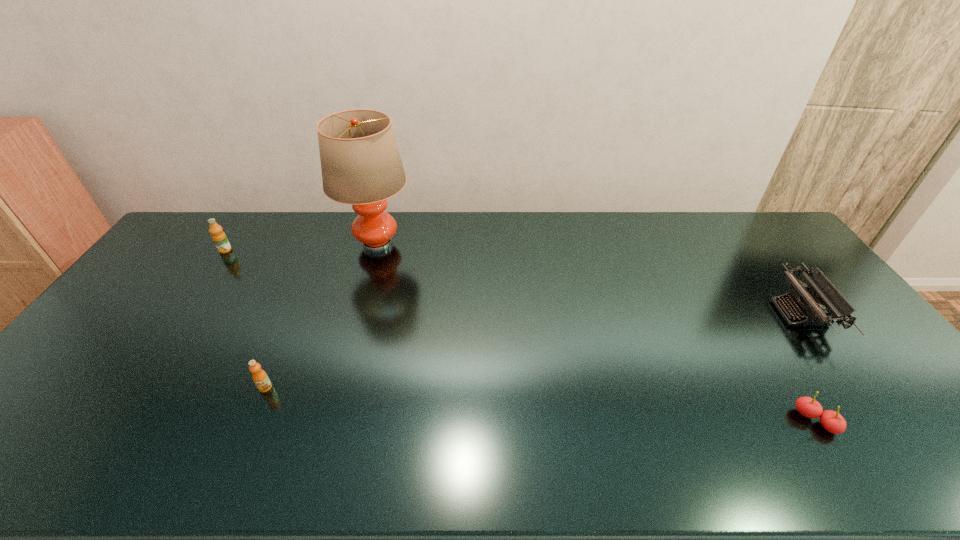
I want to click on free space located 0.390m on the right of the third object from right to left, so click(x=523, y=244).

Locate an element on the screen. This screenshot has width=960, height=540. vacant region located 0.160m on the label of the second tallest object is located at coordinates (202, 286).

At what (x,y) coordinates should I click in order to perform the action: click on vacant space situated on the typing side of the third nearest object. Please return your answer as a coordinate pair (x, y). This screenshot has height=540, width=960. Looking at the image, I should click on (755, 313).

At what (x,y) coordinates should I click in order to perform the action: click on free space located on the typing side of the third nearest object. Please return your answer as a coordinate pair (x, y). The image size is (960, 540). Looking at the image, I should click on 668,313.

Locate an element on the screen. The width and height of the screenshot is (960, 540). vacant space situated on the typing side of the third nearest object is located at coordinates (734, 313).

Locate an element on the screen. vacant space situated on the front label of the second object from left to right is located at coordinates (228, 476).

I want to click on free region located on the left of the nearest object, so click(768, 421).

Where is `lamp that is positioned at the far edge`? The image size is (960, 540). lamp that is positioned at the far edge is located at coordinates (360, 162).

Locate an element on the screen. The height and width of the screenshot is (540, 960). orange juice that is positioned at the far edge is located at coordinates (219, 238).

At what (x,y) coordinates should I click in order to perform the action: click on object located in the right edge section of the desktop. Please return your answer as a coordinate pair (x, y). The width and height of the screenshot is (960, 540). Looking at the image, I should click on (823, 294).